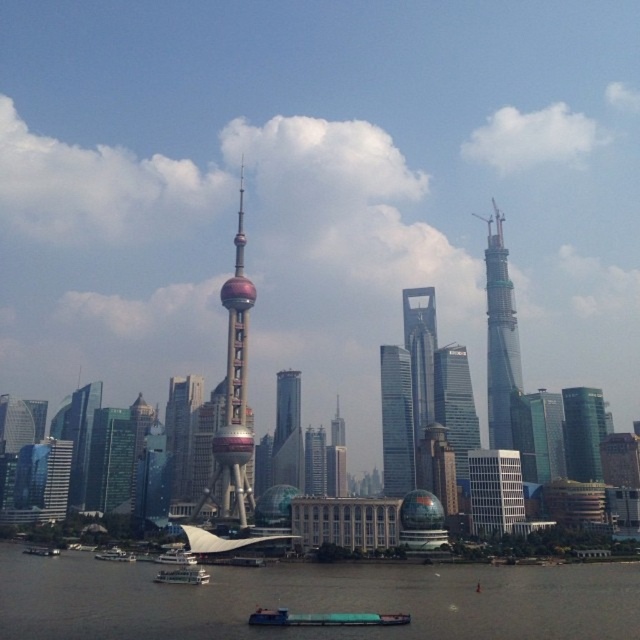
Question: Can you confirm if matte glass skyscraper at center is wider than white plastic boat at lower left?

Choices:
 (A) yes
 (B) no

Answer: (B)

Question: Which point is farther to the camera?

Choices:
 (A) matte glass skyscraper at center
 (B) sleek glass skyscraper at center-right
 (C) glassy reflective skyscraper at left

Answer: (A)

Question: Is teal matte barge at lower center further to the viewer compared to green matte boat at center?

Choices:
 (A) yes
 (B) no

Answer: (B)

Question: Estimate the real-world distances between objects in this image. Which object is closer to the white glass building at center?

Choices:
 (A) glassy reflective skyscraper at left
 (B) dark gray water at lower center

Answer: (B)

Question: Is glassy metallic skyscraper at center bigger than glassy reflective skyscraper at left?

Choices:
 (A) no
 (B) yes

Answer: (A)

Question: Which point is farther to the camera?

Choices:
 (A) (275, 464)
 (B) (509, 524)
 (C) (264, 616)
 (D) (570, 452)

Answer: (A)